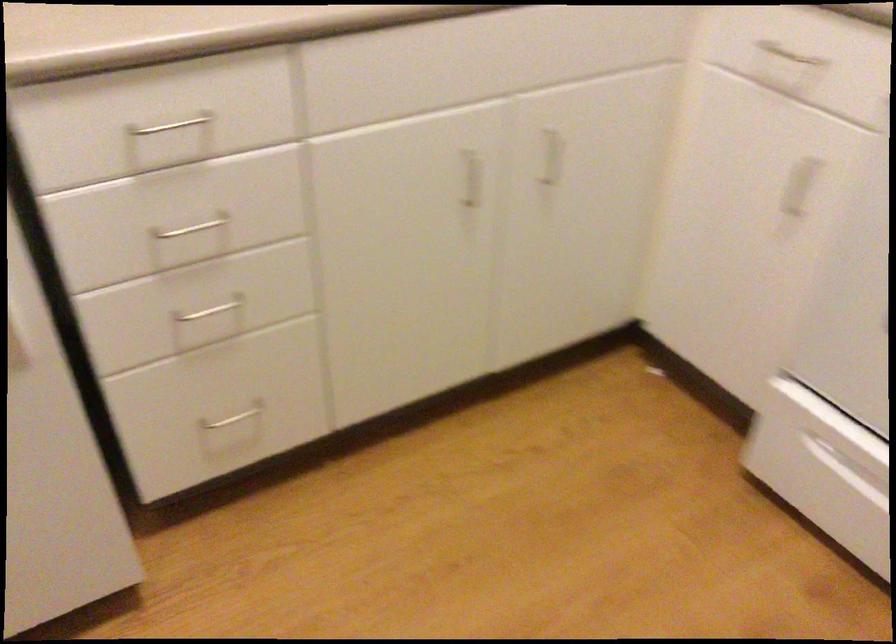
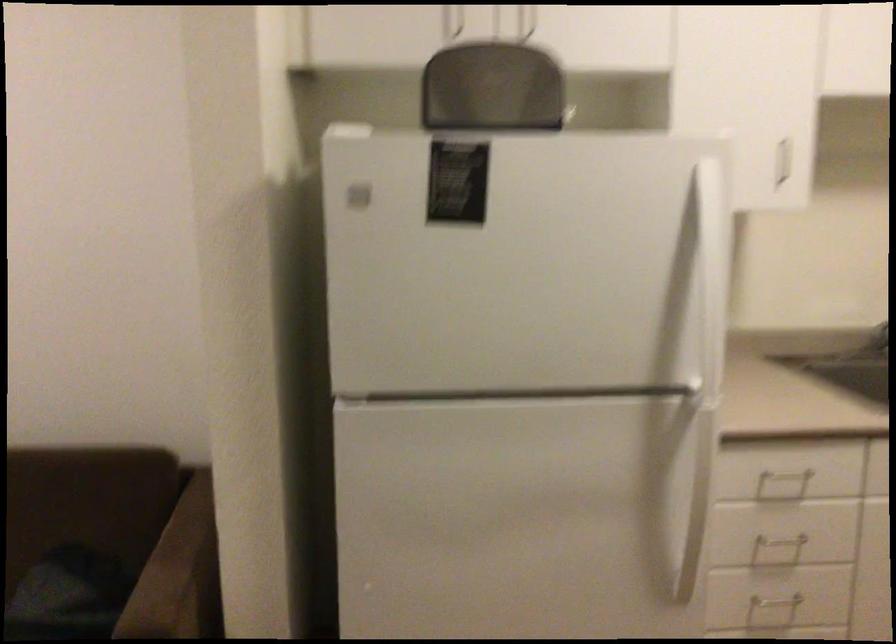
The images are taken continuously from a first-person perspective. In which direction is your viewpoint rotating?

The rotation direction of the camera is left-up.